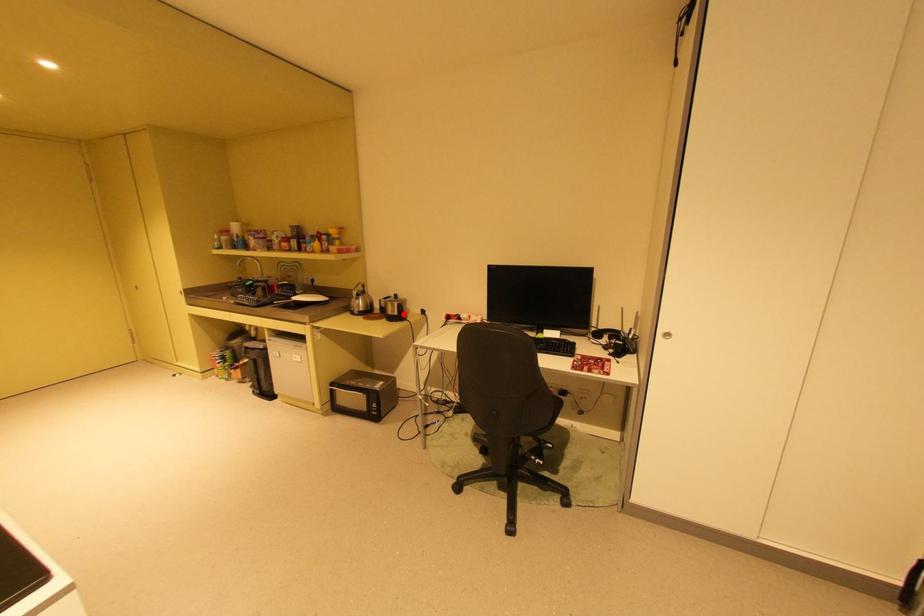
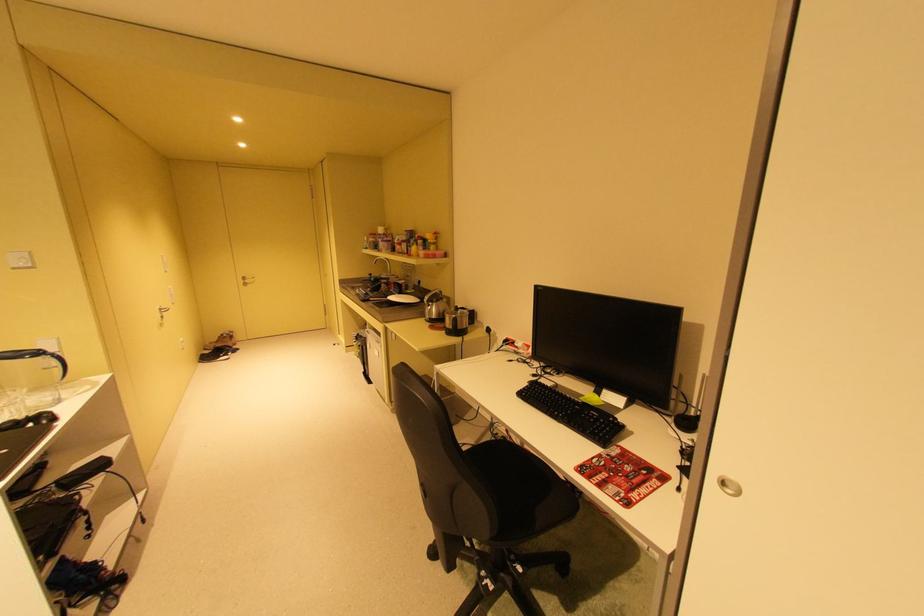
Find the pixel in the second image that matches the highlighted location in the first image.

(460, 328)